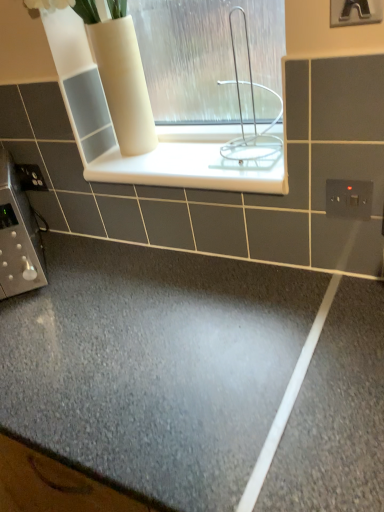
The image size is (384, 512). What do you see at coordinates (184, 163) in the screenshot? I see `white glossy ledge at center` at bounding box center [184, 163].

Measure the distance between point (30, 180) and camera.

The distance of point (30, 180) from camera is 4.24 feet.

What is the approximate height of white plastic electric outlet at upper right, which ranks as the 2th electric outlet in left-to-right order?

white plastic electric outlet at upper right, which ranks as the 2th electric outlet in left-to-right order, is 3.34 inches tall.

You are a GUI agent. You are given a task and a screenshot of the screen. Output one action in this format:
    pyautogui.click(x=<x>, y=<y>)
    Task: Click on the white glossy ledge at center
    This screenshot has height=512, width=384.
    Given the screenshot: What is the action you would take?
    pyautogui.click(x=184, y=163)

Which is more to the left, white plastic electric outlet at upper right, which ranks as the 2th electric outlet in left-to-right order, or white glossy ledge at center?

From the viewer's perspective, white glossy ledge at center appears more on the left side.

From a real-world perspective, is white plastic electric outlet at upper right, which appears as the first electric outlet when ordered from the bottom, physically above white glossy ledge at center?

No, from a real-world perspective, white plastic electric outlet at upper right, which appears as the first electric outlet when ordered from the bottom, is not over white glossy ledge at center

Does point (366, 188) lie in front of point (196, 139)?

Yes.

Is there a large distance between white plastic electric outlet at upper right, which ranks as the 1th electric outlet in right-to-left order, and white glossy ledge at center?

That's not correct — white plastic electric outlet at upper right, which ranks as the 1th electric outlet in right-to-left order, is a little close to white glossy ledge at center.

Who is bigger, white wire rack at center or white plastic electric outlet at upper right, which appears as the first electric outlet when ordered from the bottom?

With larger size is white wire rack at center.

Can you confirm if white wire rack at center is wider than white plastic electric outlet at upper right, which appears as the first electric outlet when ordered from the bottom?

Correct, the width of white wire rack at center exceeds that of white plastic electric outlet at upper right, which appears as the first electric outlet when ordered from the bottom.

Between white wire rack at center and white plastic electric outlet at upper right, the 1th electric outlet from the front, which one appears on the right side from the viewer's perspective?

From the viewer's perspective, white plastic electric outlet at upper right, the 1th electric outlet from the front, appears more on the right side.

From the image's perspective, is white wire rack at center above or below white plastic electric outlet at upper right, which ranks as the 2th electric outlet in left-to-right order?

white wire rack at center is situated higher than white plastic electric outlet at upper right, which ranks as the 2th electric outlet in left-to-right order, in the image.

Is white glossy ledge at center to the left or to the right of satin silver switch at lower left, the second electric outlet positioned from the right, in the image?

Based on their positions, white glossy ledge at center is located to the right of satin silver switch at lower left, the second electric outlet positioned from the right.

Which object is thinner, white glossy ledge at center or satin silver switch at lower left, the 2th electric outlet in the front-to-back sequence?

Thinner between the two is satin silver switch at lower left, the 2th electric outlet in the front-to-back sequence.

In the image, is white glossy ledge at center positioned in front of or behind satin silver switch at lower left, the first electric outlet in the back-to-front sequence?

Clearly, white glossy ledge at center is in front of satin silver switch at lower left, the first electric outlet in the back-to-front sequence.

From the image's perspective, which is below, white glossy ledge at center or satin silver switch at lower left, which ranks as the 2th electric outlet in bottom-to-top order?

satin silver switch at lower left, which ranks as the 2th electric outlet in bottom-to-top order, is shown below in the image.

Considering the sizes of satin silver switch at lower left, marked as the first electric outlet in a top-to-bottom arrangement, and white glossy ledge at center in the image, is satin silver switch at lower left, marked as the first electric outlet in a top-to-bottom arrangement, wider or thinner than white glossy ledge at center?

Considering their sizes, satin silver switch at lower left, marked as the first electric outlet in a top-to-bottom arrangement, looks slimmer than white glossy ledge at center.

From the image's perspective, starting from the white glossy ledge at center, which electric outlet is the 1st one below? Please provide its 2D coordinates.

[(30, 177)]

Is satin silver switch at lower left, the 2th electric outlet in the front-to-back sequence, surrounding white glossy ledge at center?

No, white glossy ledge at center is located outside of satin silver switch at lower left, the 2th electric outlet in the front-to-back sequence.

From the image's perspective, between white wire rack at center and white glossy ledge at center, who is located below?

white glossy ledge at center is shown below in the image.

The height and width of the screenshot is (512, 384). What are the coordinates of `ledge that appears on the left of white wire rack at center` in the screenshot? It's located at (184, 163).

Based on their sizes in the image, would you say white wire rack at center is bigger or smaller than white glossy ledge at center?

white wire rack at center is bigger than white glossy ledge at center.

Is white wire rack at center not close to white glossy ledge at center?

white wire rack at center is near white glossy ledge at center, not far away.

Is white glossy ledge at center shorter than white wire rack at center?

Correct, white glossy ledge at center is not as tall as white wire rack at center.

Where is `window above the white glossy ledge at center (from a real-world perspective)`? The width and height of the screenshot is (384, 512). window above the white glossy ledge at center (from a real-world perspective) is located at coordinates [x=208, y=58].

Which is more to the right, white glossy ledge at center or white wire rack at center?

Positioned to the right is white wire rack at center.

Is white glossy ledge at center not close to white plastic electric outlet at upper right, which ranks as the 1th electric outlet in right-to-left order?

That's not correct — white glossy ledge at center is a little close to white plastic electric outlet at upper right, which ranks as the 1th electric outlet in right-to-left order.

Between white glossy ledge at center and white plastic electric outlet at upper right, acting as the 2th electric outlet starting from the top, which one has more height?

With more height is white plastic electric outlet at upper right, acting as the 2th electric outlet starting from the top.

Is the position of white glossy ledge at center more distant than that of white plastic electric outlet at upper right, which appears as the first electric outlet when ordered from the bottom?

Yes, the depth of white glossy ledge at center is greater than that of white plastic electric outlet at upper right, which appears as the first electric outlet when ordered from the bottom.

From a real-world perspective, which electric outlet is the 2nd one underneath the white glossy ledge at center? Please provide its 2D coordinates.

[(349, 199)]

Find the location of `window located on the left of white plastic electric outlet at upper right, which appears as the first electric outlet when ordered from the bottom`. window located on the left of white plastic electric outlet at upper right, which appears as the first electric outlet when ordered from the bottom is located at coordinates click(x=208, y=58).

From the image, which object appears to be nearer to white wire rack at center, white plastic electric outlet at upper right, which appears as the first electric outlet when ordered from the bottom, or satin silver switch at lower left, the first electric outlet from the left?

white plastic electric outlet at upper right, which appears as the first electric outlet when ordered from the bottom, lies closer to white wire rack at center than the other object.

Looking at the image, which one is located further to satin silver switch at lower left, the first electric outlet from the left, white plastic electric outlet at upper right, acting as the 2th electric outlet starting from the top, or white wire rack at center?

white plastic electric outlet at upper right, acting as the 2th electric outlet starting from the top, is positioned further to the anchor satin silver switch at lower left, the first electric outlet from the left.

Looking at the image, which one is located closer to satin silver switch at lower left, the 2th electric outlet in the front-to-back sequence, white wire rack at center or white glossy ledge at center?

white glossy ledge at center lies closer to satin silver switch at lower left, the 2th electric outlet in the front-to-back sequence, than the other object.

When comparing their distances from white plastic electric outlet at upper right, acting as the 2th electric outlet starting from the top, does white glossy ledge at center or satin silver switch at lower left, the second electric outlet positioned from the right, seem closer?

white glossy ledge at center is closer to white plastic electric outlet at upper right, acting as the 2th electric outlet starting from the top.

Consider the image. Estimate the real-world distances between objects in this image. Which object is further from white plastic electric outlet at upper right, acting as the 2th electric outlet starting from the top, satin silver switch at lower left, marked as the first electric outlet in a top-to-bottom arrangement, or white wire rack at center?

satin silver switch at lower left, marked as the first electric outlet in a top-to-bottom arrangement, is positioned further to the anchor white plastic electric outlet at upper right, acting as the 2th electric outlet starting from the top.

Considering their positions, is white glossy ledge at center positioned closer to white wire rack at center than satin silver switch at lower left, the first electric outlet in the back-to-front sequence?

white glossy ledge at center lies closer to white wire rack at center than the other object.

Based on their spatial positions, is white plastic electric outlet at upper right, the 1th electric outlet from the front, or white glossy ledge at center further from satin silver switch at lower left, the first electric outlet from the left?

white plastic electric outlet at upper right, the 1th electric outlet from the front.

Looking at the image, which one is located closer to satin silver switch at lower left, the first electric outlet in the back-to-front sequence, white glossy ledge at center or white wire rack at center?

white glossy ledge at center is positioned closer to the anchor satin silver switch at lower left, the first electric outlet in the back-to-front sequence.

What are the coordinates of `window between satin silver switch at lower left, the second electric outlet positioned from the right, and white plastic electric outlet at upper right, which ranks as the 2th electric outlet in back-to-front order, from left to right` in the screenshot? It's located at (208, 58).

The height and width of the screenshot is (512, 384). I want to click on window between white glossy ledge at center and white plastic electric outlet at upper right, which ranks as the 1th electric outlet in right-to-left order, in the horizontal direction, so click(x=208, y=58).

You are a GUI agent. You are given a task and a screenshot of the screen. Output one action in this format:
    pyautogui.click(x=<x>, y=<y>)
    Task: Click on the ledge between satin silver switch at lower left, marked as the first electric outlet in a top-to-bottom arrangement, and white wire rack at center
    
    Given the screenshot: What is the action you would take?
    pyautogui.click(x=184, y=163)

This screenshot has height=512, width=384. I want to click on ledge between satin silver switch at lower left, the second electric outlet positioned from the right, and white plastic electric outlet at upper right, which ranks as the 2th electric outlet in back-to-front order, from left to right, so [184, 163].